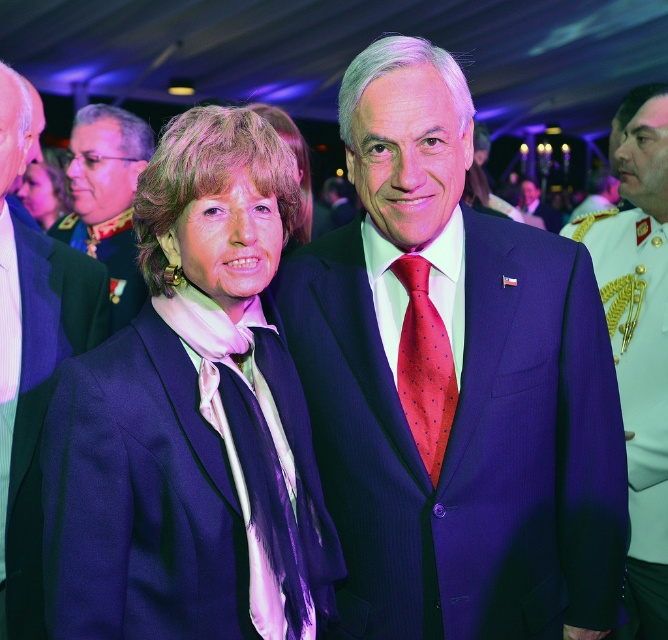
Question: Among these points, which one is nearest to the camera?

Choices:
 (A) (546, 221)
 (B) (57, 227)

Answer: (B)

Question: Can you confirm if gold embroidered uniform at right is positioned to the right of matte black jacket at upper left?

Choices:
 (A) yes
 (B) no

Answer: (A)

Question: Is green wool suit at left wider than green military uniform at center?

Choices:
 (A) no
 (B) yes

Answer: (A)

Question: Which point is closer to the camera?

Choices:
 (A) matte purple suit at center
 (B) green military uniform at center
 (C) green wool suit at left
 (D) polka dot silk tie at center

Answer: (A)

Question: Which is nearer to the polka dot silk tie at center?

Choices:
 (A) matte black suit at center
 (B) matte purple suit at center
 (C) green military uniform at center

Answer: (B)

Question: Is gold embroidered uniform at right wider than matte black suit at center?

Choices:
 (A) no
 (B) yes

Answer: (A)